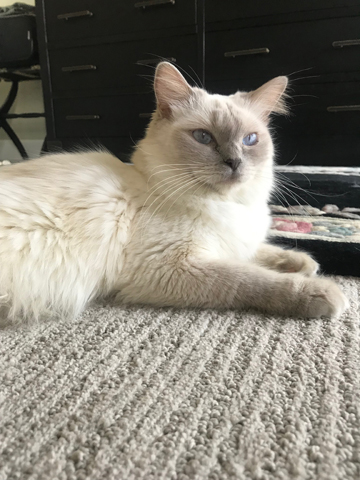
Locate an element on the screen. carpeting is located at coordinates (223, 352), (352, 282).